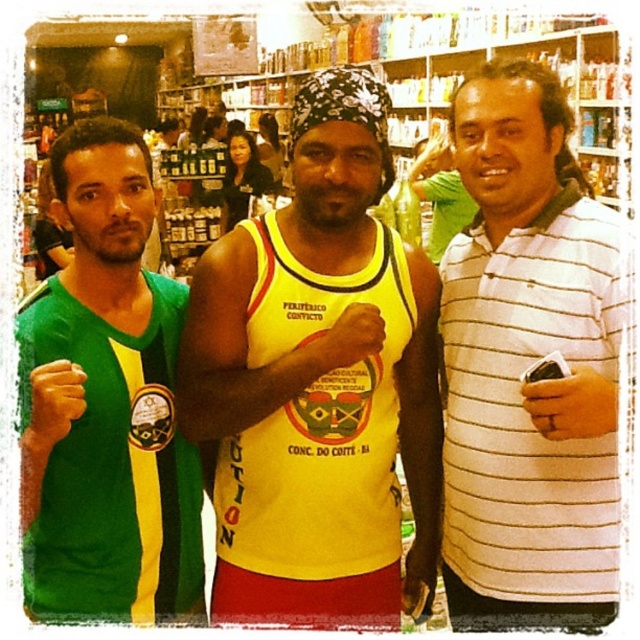
Question: Which point is closer to the camera?

Choices:
 (A) (104, 406)
 (B) (436, 451)

Answer: (A)

Question: Where is white striped polo shirt at right located in relation to green jersey at left in the image?

Choices:
 (A) left
 (B) right

Answer: (B)

Question: From the image, what is the correct spatial relationship of white striped polo shirt at right in relation to green jersey at left?

Choices:
 (A) below
 (B) above

Answer: (B)

Question: Among these points, which one is farthest from the camera?

Choices:
 (A) (500, 572)
 (B) (26, 500)

Answer: (A)

Question: Does yellow fabric tank top at center appear over white striped polo shirt at right?

Choices:
 (A) no
 (B) yes

Answer: (A)

Question: Among these points, which one is farthest from the camera?

Choices:
 (A) (346, 440)
 (B) (148, 296)
 (C) (532, 83)

Answer: (B)